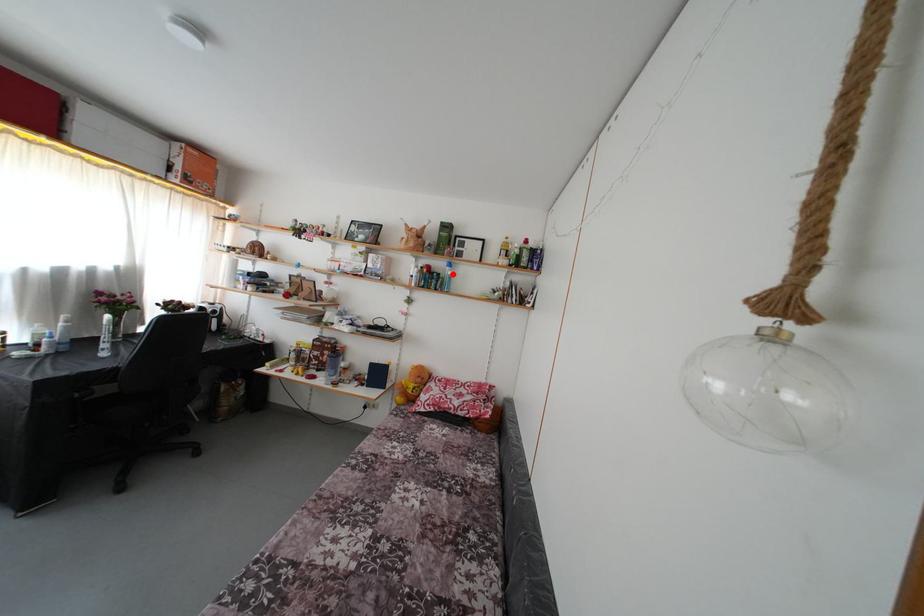
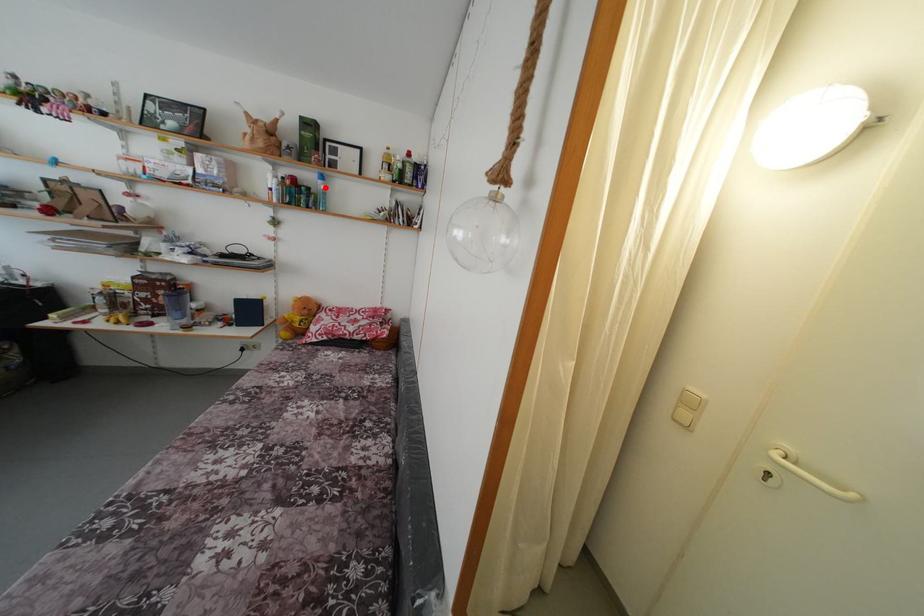
I am providing you with two images of the same scene from different viewpoints. A red point is marked on the first image and another point is marked on the second image. Are the points marked in image1 and image2 representing the same 3D position?

Yes